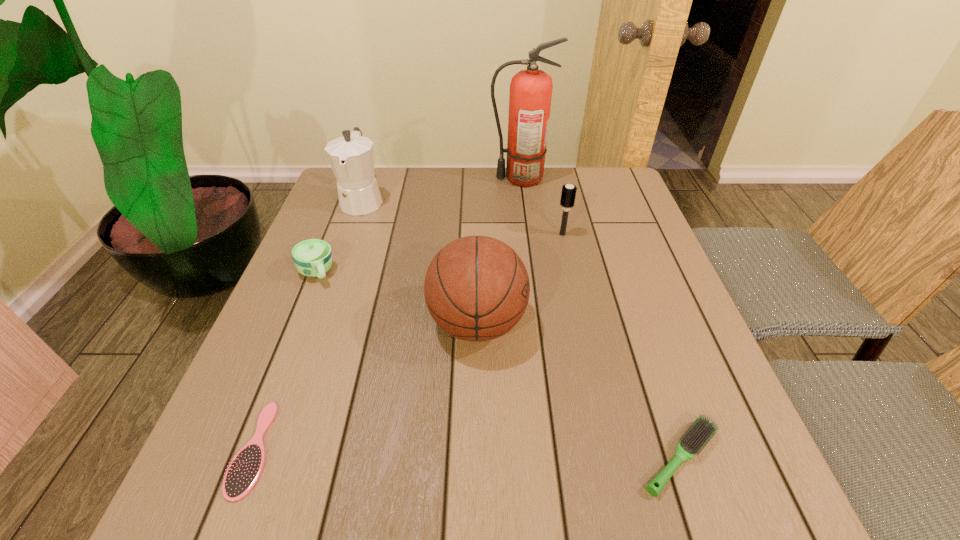
This screenshot has height=540, width=960. Find the location of `the leftmost hairbrush`. the leftmost hairbrush is located at coordinates (245, 469).

Locate an element on the screen. Image resolution: width=960 pixels, height=540 pixels. blank area located on the nozzle of the tallest object is located at coordinates (405, 178).

Image resolution: width=960 pixels, height=540 pixels. I want to click on vacant space located on the nozzle of the tallest object, so (x=408, y=178).

Identify the location of vacant space located on the nozzle of the tallest object. This screenshot has height=540, width=960. (396, 178).

Locate an element on the screen. The height and width of the screenshot is (540, 960). free space located 0.170m at the spout of the coffeepot is located at coordinates click(x=341, y=262).

You are a GUI agent. You are given a task and a screenshot of the screen. Output one action in this format:
    pyautogui.click(x=<x>, y=<y>)
    Task: Click on the vacant space situated on the side with brand label of the basketball
    
    Given the screenshot: What is the action you would take?
    pyautogui.click(x=612, y=323)

Identify the location of vacant space located 0.270m on the front of the tallest hairbrush. The width and height of the screenshot is (960, 540). click(581, 316).

Find the location of a particular element. The image size is (960, 540). vacant space located 0.240m on the back of the fifth tallest object is located at coordinates click(344, 204).

Locate an element on the screen. The width and height of the screenshot is (960, 540). vacant space situated 0.220m on the left of the rightmost object is located at coordinates (502, 458).

In order to click on vacant area situated on the back of the leftmost hairbrush in this screenshot , I will do `click(291, 354)`.